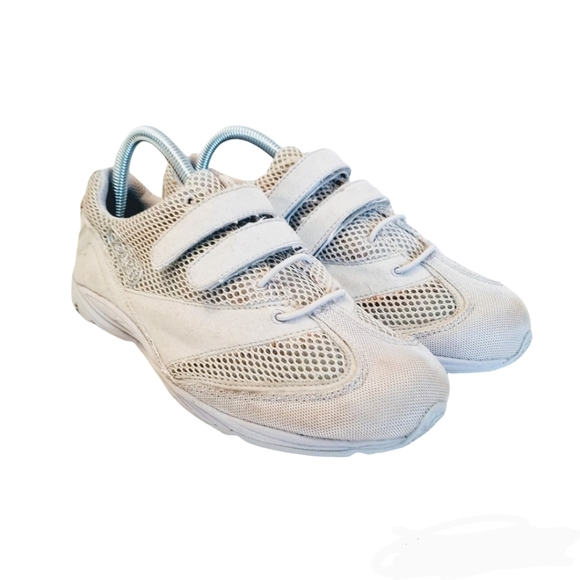
You are a GUI agent. You are given a task and a screenshot of the screen. Output one action in this format:
    pyautogui.click(x=<x>, y=<y>)
    Task: Click on the cable
    This screenshot has height=580, width=580.
    Given the screenshot: What is the action you would take?
    pyautogui.click(x=125, y=153)